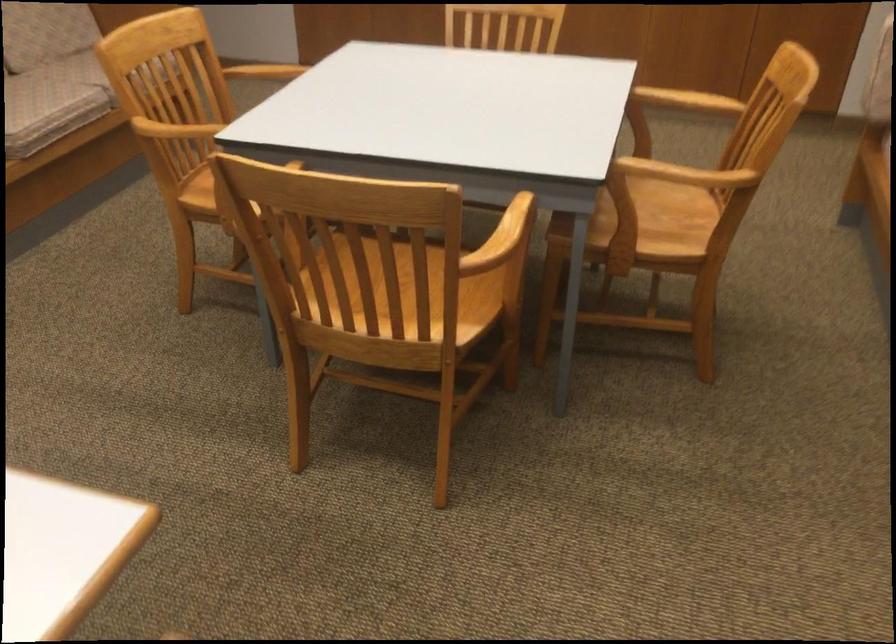
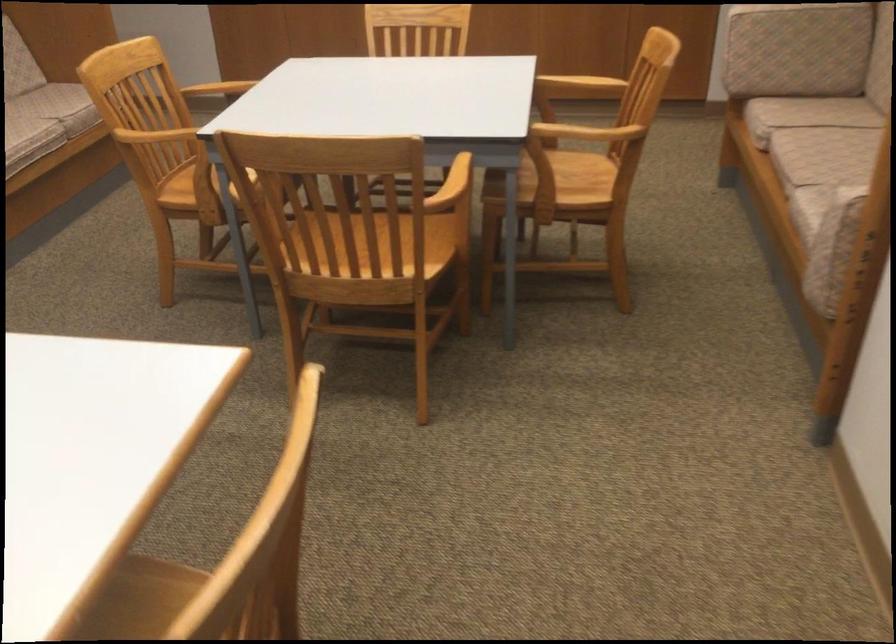
Find the pixel in the second image that matches (x=529, y=227) in the first image.

(470, 174)